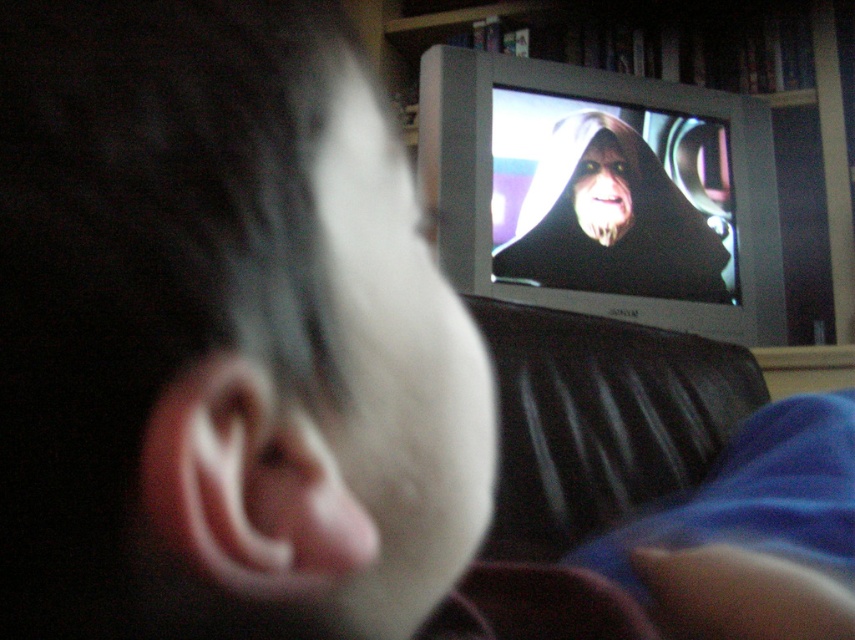
Consider the image. You are a photographer trying to capture a portrait of the person in the scene. You notice the white matte pillow at center and the matte black face at center. Which object should you focus on if you want to ensure the subject with the smaller width is in sharp focus?

You should focus on the white matte pillow at center because it has a lesser width compared to the matte black face at center, making it the smaller subject.

From the picture: You are standing in the room shown in the image. There is a point at coordinates point (482,51). Can you reach this point without moving your feet?

The point at coordinates point (482,51) is 6.30 feet away from you, so you cannot reach it without moving your feet since it is too far.

You are trying to decide where to place a new decorative item in the room. The wooden bookshelf at upper center and the white matte pillow at center are already present. Which object is located higher up in the scene?

The wooden bookshelf at upper center is positioned over the white matte pillow at center, so it is higher up in the scene.